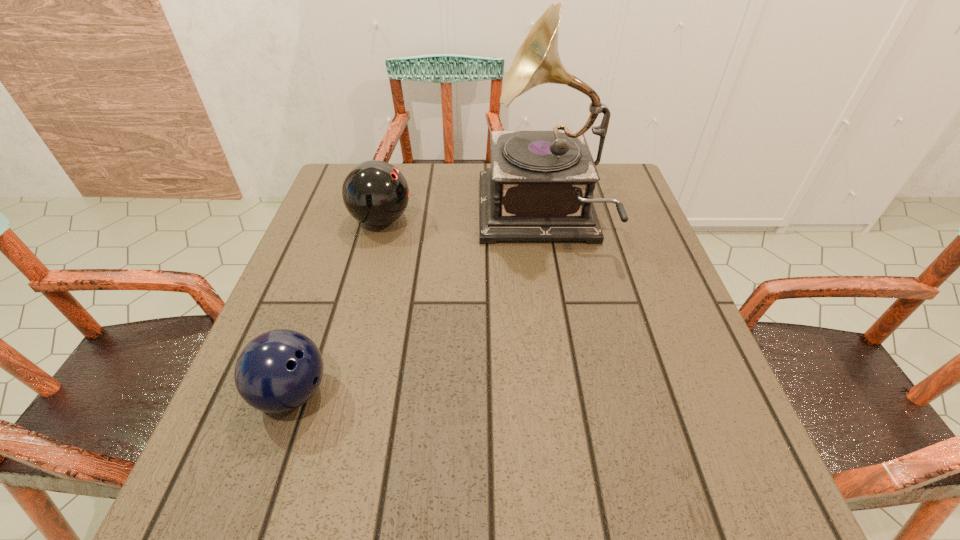
Identify the location of vacant space located 0.080m on the surface of the nearest object near the finger holes. This screenshot has width=960, height=540. (378, 393).

What are the coordinates of `record player at the far edge` in the screenshot? It's located at (540, 186).

In order to click on bowling ball at the far edge in this screenshot , I will do `click(375, 193)`.

The height and width of the screenshot is (540, 960). I want to click on object that is at the right edge, so (540, 186).

Where is `object that is at the far left corner`? The image size is (960, 540). object that is at the far left corner is located at coordinates (375, 193).

Where is `object situated at the far right corner`? object situated at the far right corner is located at coordinates (540, 186).

At what (x,y) coordinates should I click in order to perform the action: click on free space at the far edge. Please return your answer as a coordinate pair (x, y). Image resolution: width=960 pixels, height=540 pixels. Looking at the image, I should click on (452, 164).

Where is `blank space at the near edge of the desktop`? blank space at the near edge of the desktop is located at coordinates (372, 483).

I want to click on blank space at the left edge of the desktop, so click(x=303, y=444).

Find the location of `vacant area at the right edge`. vacant area at the right edge is located at coordinates (687, 333).